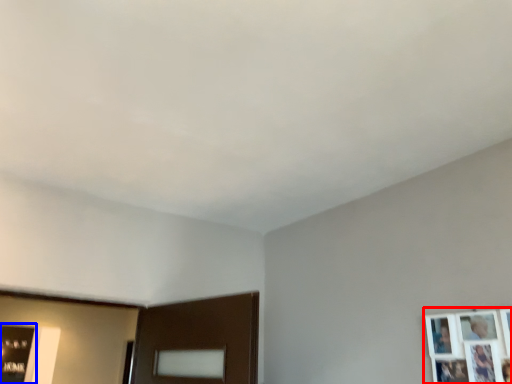
Question: Which object is closer to the camera taking this photo, picture frame (highlighted by a red box) or picture frame (highlighted by a blue box)?

Choices:
 (A) picture frame
 (B) picture frame

Answer: (A)